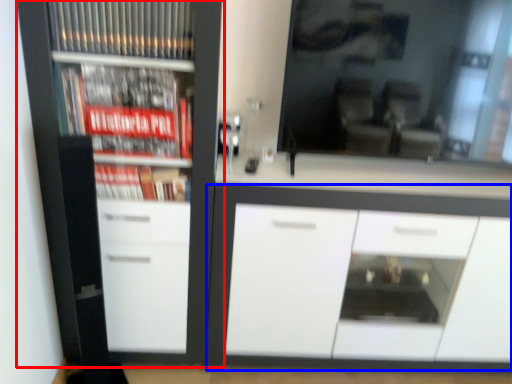
Question: Among these objects, which one is farthest to the camera, cupboard (highlighted by a red box) or cabinetry (highlighted by a blue box)?

Choices:
 (A) cupboard
 (B) cabinetry

Answer: (B)